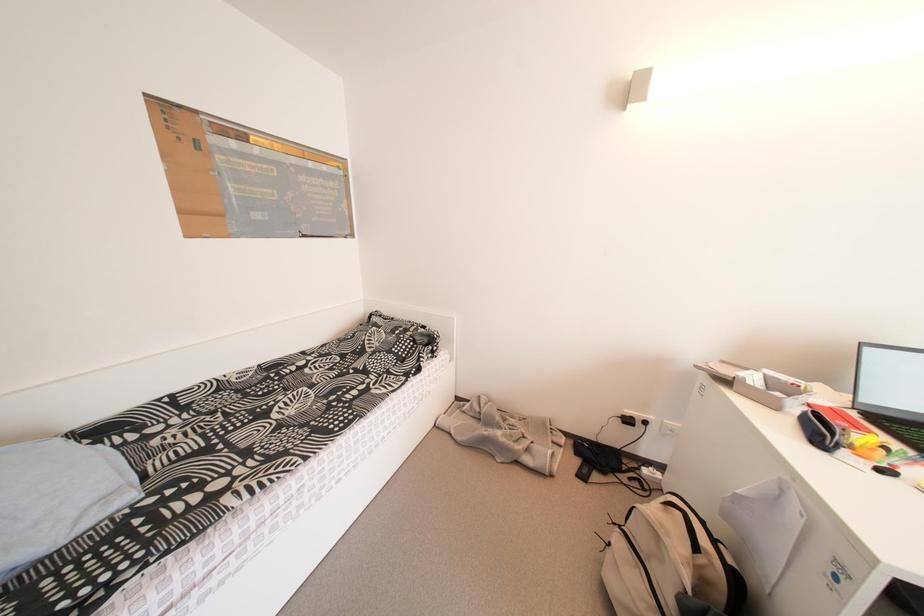
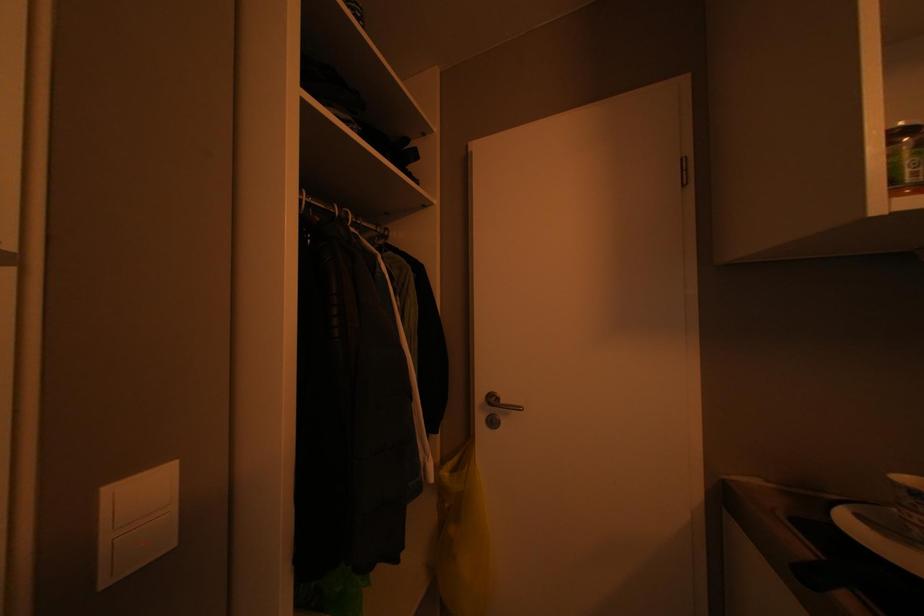
Question: Which direction would the cameraman need to move to produce the second image? Reply with the corresponding letter.

Choices:
 (A) Left
 (B) Right
 (C) Forward
 (D) Backward

Answer: (A)